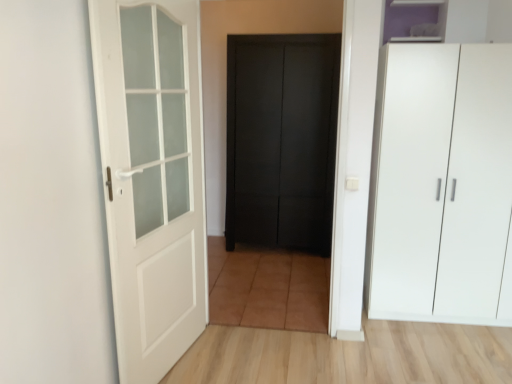
Locate an element on the screen. The image size is (512, 384). white matte door at left, the 2th door positioned from the right is located at coordinates (152, 177).

The image size is (512, 384). What do you see at coordinates (282, 140) in the screenshot?
I see `matte black door at center, positioned as the 1th door in back-to-front order` at bounding box center [282, 140].

This screenshot has width=512, height=384. In order to click on white matte cupboard at right in this screenshot , I will do (x=443, y=184).

Which object is positioned more to the right, white matte door at left, the first door positioned from the left, or matte black door at center, positioned as the 1th door in back-to-front order?

From the viewer's perspective, matte black door at center, positioned as the 1th door in back-to-front order, appears more on the right side.

The width and height of the screenshot is (512, 384). Find the location of `door located below the matte black door at center, acting as the second door starting from the front (from the image's perspective)`. door located below the matte black door at center, acting as the second door starting from the front (from the image's perspective) is located at coordinates (152, 177).

From the picture: Does white matte door at left, the first door positioned from the left, lie in front of matte black door at center, acting as the second door starting from the front?

Yes, it is.

Is matte black door at center, positioned as the 1th door in back-to-front order, in front of white matte door at left, the 2th door positioned from the right?

No.

Is matte black door at center, the first door when ordered from right to left, touching white matte door at left, the first door positioned from the left?

They are not placed beside each other.

Measure the distance from matte black door at center, acting as the second door starting from the front, to white matte door at left, the 2th door positioned from the right.

matte black door at center, acting as the second door starting from the front, is 1.57 meters from white matte door at left, the 2th door positioned from the right.

Consider the image. From a real-world perspective, is white matte cupboard at right beneath purple matte cabinet at upper right?

Correct, in the physical world, white matte cupboard at right is lower than purple matte cabinet at upper right.

Considering the sizes of white matte cupboard at right and purple matte cabinet at upper right in the image, is white matte cupboard at right wider or thinner than purple matte cabinet at upper right?

In the image, white matte cupboard at right appears to be wider than purple matte cabinet at upper right.

Where is `cabinetry behind the white matte cupboard at right`? Image resolution: width=512 pixels, height=384 pixels. cabinetry behind the white matte cupboard at right is located at coordinates (440, 19).

Is white matte cupboard at right facing away from purple matte cabinet at upper right?

No, purple matte cabinet at upper right is not at the back of white matte cupboard at right.

In the image, is white matte door at left, the 2th door positioned from the right, on the left side or the right side of white matte cupboard at right?

In the image, white matte door at left, the 2th door positioned from the right, appears on the left side of white matte cupboard at right.

Do you think white matte door at left, which ranks as the 1th door in front-to-back order, is within white matte cupboard at right, or outside of it?

white matte door at left, which ranks as the 1th door in front-to-back order, is not inside white matte cupboard at right, it's outside.

Is white matte door at left, the first door positioned from the left, aimed at white matte cupboard at right?

No, white matte door at left, the first door positioned from the left, is not turned towards white matte cupboard at right.

Which is behind, white matte door at left, the 2th door when ordered from back to front, or white matte cupboard at right?

white matte cupboard at right is more distant.

Looking at this image, from a real-world perspective, between matte black door at center, the first door when ordered from right to left, and purple matte cabinet at upper right, who is vertically lower?

matte black door at center, the first door when ordered from right to left.

In the scene shown: Is matte black door at center, acting as the second door starting from the front, with purple matte cabinet at upper right?

matte black door at center, acting as the second door starting from the front, is not next to purple matte cabinet at upper right, and they're not touching.

Visually, is matte black door at center, placed as the second door when sorted from left to right, positioned to the left or to the right of purple matte cabinet at upper right?

Clearly, matte black door at center, placed as the second door when sorted from left to right, is on the left of purple matte cabinet at upper right in the image.

Who is bigger, white matte cupboard at right or white matte door at left, the 2th door positioned from the right?

white matte cupboard at right is bigger.

Measure the distance between white matte cupboard at right and white matte door at left, the first door positioned from the left.

A distance of 1.43 meters exists between white matte cupboard at right and white matte door at left, the first door positioned from the left.

Considering the points (441, 109) and (131, 304), which point is behind, point (441, 109) or point (131, 304)?

The point (441, 109) is behind.

Are white matte cupboard at right and white matte door at left, the 2th door when ordered from back to front, beside each other?

No, white matte cupboard at right is not making contact with white matte door at left, the 2th door when ordered from back to front.

Is white matte cupboard at right at the back of purple matte cabinet at upper right?

purple matte cabinet at upper right does not have its back to white matte cupboard at right.

From the image's perspective, who appears lower, purple matte cabinet at upper right or white matte cupboard at right?

white matte cupboard at right, from the image's perspective.

Can you see purple matte cabinet at upper right touching white matte cupboard at right?

No.

Considering the positions of objects purple matte cabinet at upper right and white matte cupboard at right in the image provided, who is in front, purple matte cabinet at upper right or white matte cupboard at right?

white matte cupboard at right.

Find the location of `door above the white matte door at left, the first door positioned from the left (from the image's perspective)`. door above the white matte door at left, the first door positioned from the left (from the image's perspective) is located at coordinates (282, 140).

At what (x,y) coordinates should I click in order to perform the action: click on door located on the right of white matte door at left, the 2th door when ordered from back to front. Please return your answer as a coordinate pair (x, y). This screenshot has height=384, width=512. Looking at the image, I should click on (282, 140).

Based on their spatial positions, is white matte cupboard at right or purple matte cabinet at upper right further from matte black door at center, acting as the second door starting from the front?

Based on the image, white matte cupboard at right appears to be further to matte black door at center, acting as the second door starting from the front.

Based on their spatial positions, is white matte door at left, the 2th door positioned from the right, or white matte cupboard at right closer to matte black door at center, the first door when ordered from right to left?

white matte cupboard at right.

Looking at the image, which one is located closer to matte black door at center, positioned as the 1th door in back-to-front order, purple matte cabinet at upper right or white matte door at left, the 2th door when ordered from back to front?

Based on the image, purple matte cabinet at upper right appears to be nearer to matte black door at center, positioned as the 1th door in back-to-front order.

Looking at the image, which one is located closer to purple matte cabinet at upper right, white matte cupboard at right or white matte door at left, which ranks as the 1th door in front-to-back order?

white matte cupboard at right is closer to purple matte cabinet at upper right.

In the scene shown: Based on their spatial positions, is purple matte cabinet at upper right or matte black door at center, positioned as the 1th door in back-to-front order, closer to white matte cupboard at right?

The object closer to white matte cupboard at right is purple matte cabinet at upper right.

Considering their positions, is purple matte cabinet at upper right positioned further to white matte cupboard at right than white matte door at left, which ranks as the 1th door in front-to-back order?

white matte door at left, which ranks as the 1th door in front-to-back order, lies further to white matte cupboard at right than the other object.

Considering their positions, is white matte door at left, the 2th door positioned from the right, positioned further to white matte cupboard at right than purple matte cabinet at upper right?

white matte door at left, the 2th door positioned from the right, is positioned further to the anchor white matte cupboard at right.

Based on their spatial positions, is white matte cupboard at right or matte black door at center, positioned as the 1th door in back-to-front order, closer to purple matte cabinet at upper right?

Among the two, white matte cupboard at right is located nearer to purple matte cabinet at upper right.

I want to click on cabinetry situated between white matte door at left, which ranks as the 1th door in front-to-back order, and white matte cupboard at right from left to right, so click(440, 19).

This screenshot has height=384, width=512. Find the location of `cupboard between white matte door at left, the 2th door when ordered from back to front, and matte black door at center, placed as the second door when sorted from left to right, from front to back`. cupboard between white matte door at left, the 2th door when ordered from back to front, and matte black door at center, placed as the second door when sorted from left to right, from front to back is located at coordinates pyautogui.click(x=443, y=184).

Identify the location of cabinetry between white matte cupboard at right and matte black door at center, acting as the second door starting from the front, in the front-back direction. The image size is (512, 384). (440, 19).

This screenshot has height=384, width=512. Find the location of `cabinetry positioned between white matte door at left, the 2th door when ordered from back to front, and matte black door at center, the first door when ordered from right to left, from near to far`. cabinetry positioned between white matte door at left, the 2th door when ordered from back to front, and matte black door at center, the first door when ordered from right to left, from near to far is located at coordinates (440, 19).